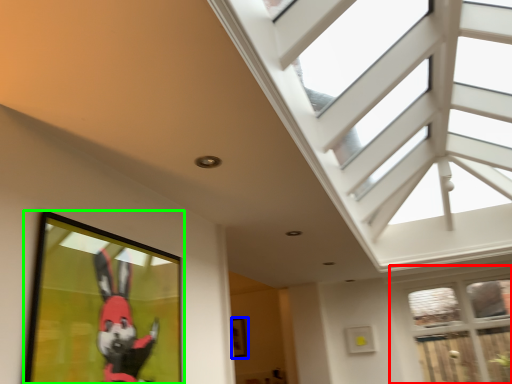
Question: Estimate the real-world distances between objects in this image. Which object is farther from window (highlighted by a red box), picture frame (highlighted by a blue box) or picture frame (highlighted by a green box)?

Choices:
 (A) picture frame
 (B) picture frame

Answer: (B)